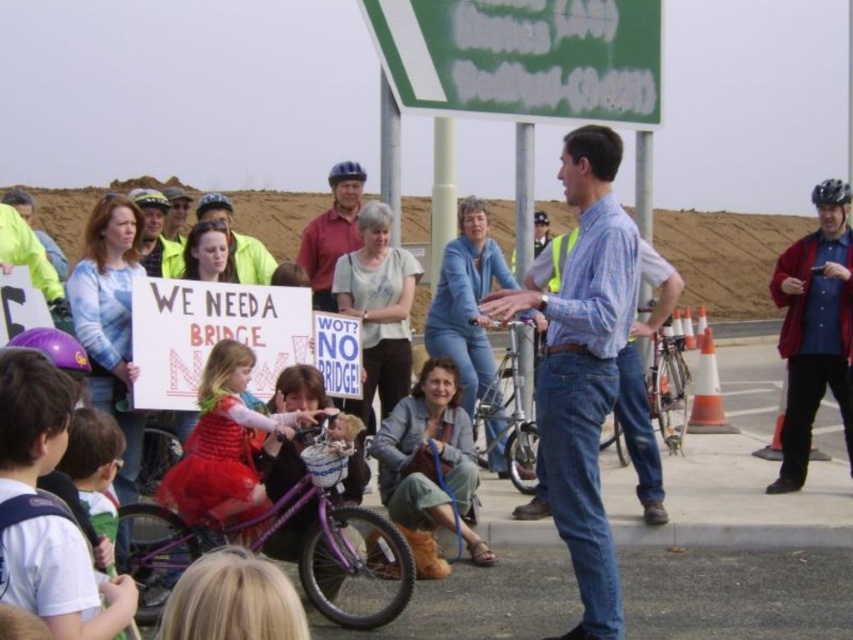
In the scene shown: How distant is matte red dress at center from matte yellow helmet at center?

The distance of matte red dress at center from matte yellow helmet at center is 20.15 meters.

Which is in front, point (288, 426) or point (183, 211)?

Point (288, 426) is in front.

Is point (213, 488) positioned behind point (175, 227)?

No, (213, 488) is closer to viewer.

The width and height of the screenshot is (853, 640). What are the coordinates of `matte red dress at center` in the screenshot? It's located at (225, 449).

Between point (335, 330) and point (74, 368), which one is positioned in front?

Positioned in front is point (74, 368).

You are a GUI agent. You are given a task and a screenshot of the screen. Output one action in this format:
    pyautogui.click(x=<x>, y=<y>)
    Task: Click on the blue paper sign at center
    This screenshot has height=640, width=853.
    Given the screenshot: What is the action you would take?
    pyautogui.click(x=338, y=353)

Image resolution: width=853 pixels, height=640 pixels. Identify the location of blue paper sign at center. (338, 353).

Is matte yellow helmet at upper center bigger than purple matte bicycle helmet at center?

Yes, matte yellow helmet at upper center is bigger than purple matte bicycle helmet at center.

Does point (218, 216) come closer to viewer compared to point (534, 221)?

Yes, point (218, 216) is closer to viewer.

In order to click on matte yellow helmet at upper center in this screenshot , I will do `click(238, 241)`.